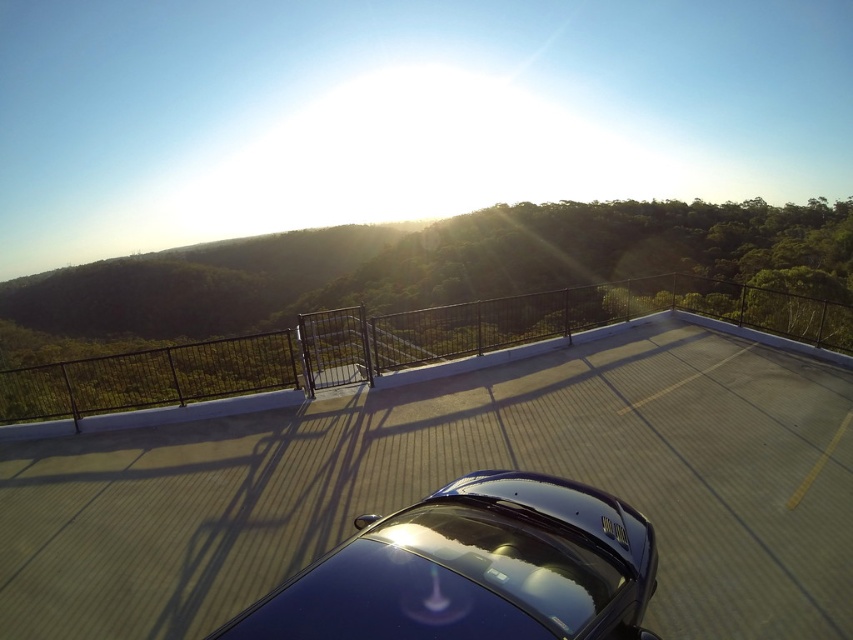
Question: From the image, what is the correct spatial relationship of glossy asphalt highway at center in relation to glossy blue car at center?

Choices:
 (A) below
 (B) above

Answer: (A)

Question: Which of the following is the farthest from the observer?

Choices:
 (A) glossy asphalt highway at center
 (B) glossy blue car at center

Answer: (A)

Question: Is glossy asphalt highway at center wider than glossy blue car at center?

Choices:
 (A) yes
 (B) no

Answer: (A)

Question: Observing the image, what is the correct spatial positioning of glossy asphalt highway at center in reference to glossy blue car at center?

Choices:
 (A) below
 (B) above

Answer: (A)